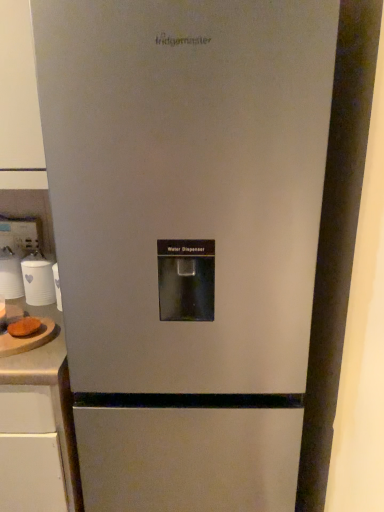
This screenshot has height=512, width=384. Find the location of `vacant space in front of brown fuzzy bread at left`. vacant space in front of brown fuzzy bread at left is located at coordinates (23, 356).